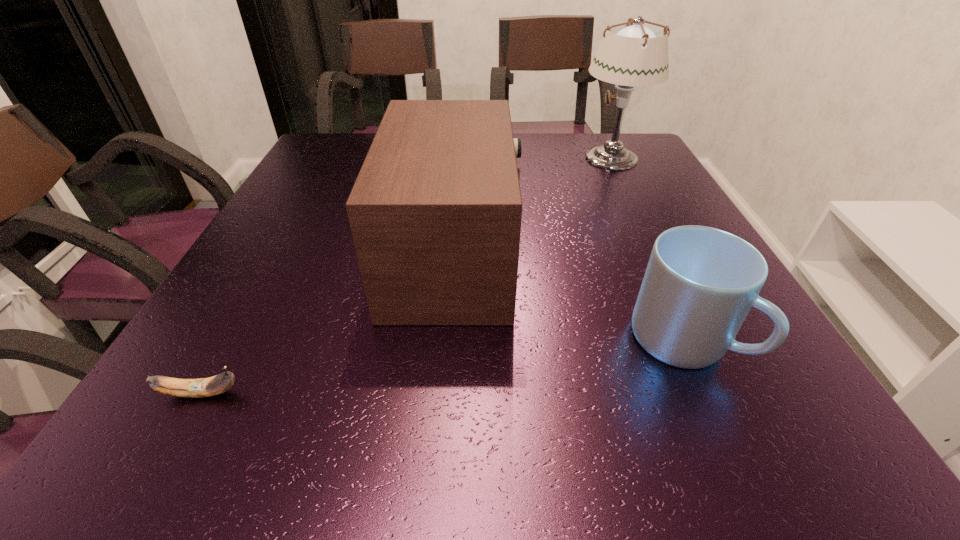
The width and height of the screenshot is (960, 540). What are the coordinates of `vacant area situated on the front-facing side of the third shortest object` in the screenshot? It's located at 637,254.

Identify the location of vacant space located 0.140m on the left of the second shortest object. (548, 341).

The image size is (960, 540). Find the location of `vacant point located 0.360m on the peel of the banana`. vacant point located 0.360m on the peel of the banana is located at coordinates (487, 393).

At what (x,y) coordinates should I click in order to perform the action: click on object positioned at the far edge. Please return your answer as a coordinate pair (x, y). Image resolution: width=960 pixels, height=540 pixels. Looking at the image, I should click on (632, 54).

The height and width of the screenshot is (540, 960). I want to click on object at the near edge, so click(x=202, y=387).

The width and height of the screenshot is (960, 540). Identify the location of object that is at the left edge. (202, 387).

Where is `lampshade present at the right edge`? lampshade present at the right edge is located at coordinates (632, 54).

Where is `mug that is at the right edge`? This screenshot has height=540, width=960. mug that is at the right edge is located at coordinates (700, 283).

This screenshot has height=540, width=960. Find the location of `object that is positioned at the near left corner`. object that is positioned at the near left corner is located at coordinates (202, 387).

In order to click on object at the far right corner in this screenshot , I will do `click(632, 54)`.